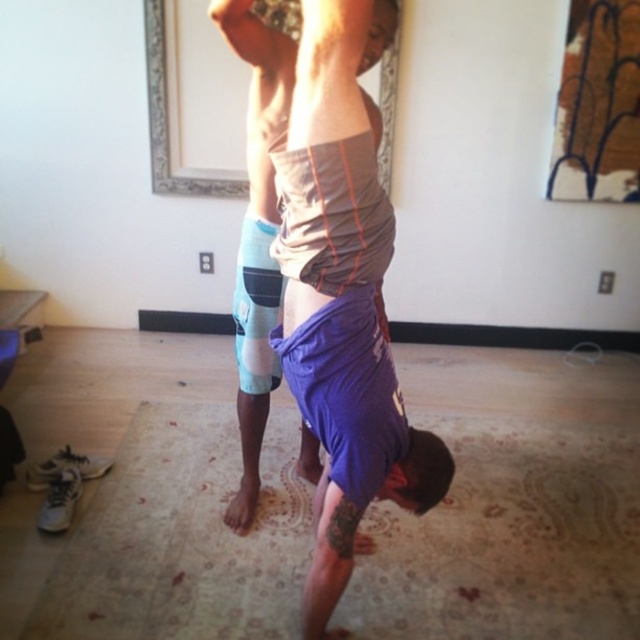
Question: Estimate the real-world distances between objects in this image. Which object is farther from the purple cotton shorts at center?

Choices:
 (A) gray matte tank top at center
 (B) purple fabric mat at lower center

Answer: (B)

Question: Is purple cotton shorts at center thinner than gray matte tank top at center?

Choices:
 (A) no
 (B) yes

Answer: (A)

Question: Does purple fabric mat at lower center appear over gray matte tank top at center?

Choices:
 (A) yes
 (B) no

Answer: (B)

Question: Does purple cotton shorts at center appear over gray matte tank top at center?

Choices:
 (A) yes
 (B) no

Answer: (B)

Question: Among these objects, which one is nearest to the camera?

Choices:
 (A) gray matte tank top at center
 (B) purple fabric mat at lower center
 (C) purple cotton shorts at center

Answer: (C)

Question: Which point is closer to the camera?

Choices:
 (A) purple fabric mat at lower center
 (B) gray matte tank top at center

Answer: (B)